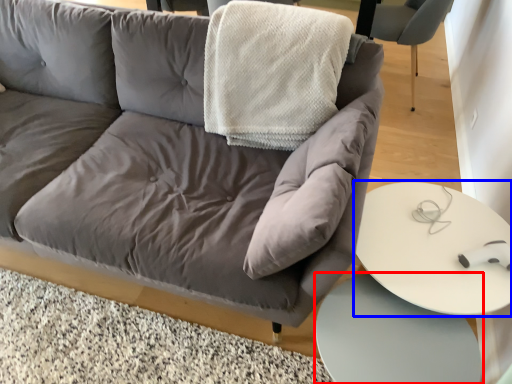
Question: Which of the following is the closest to the observer, table (highlighted by a red box) or table (highlighted by a blue box)?

Choices:
 (A) table
 (B) table

Answer: (A)